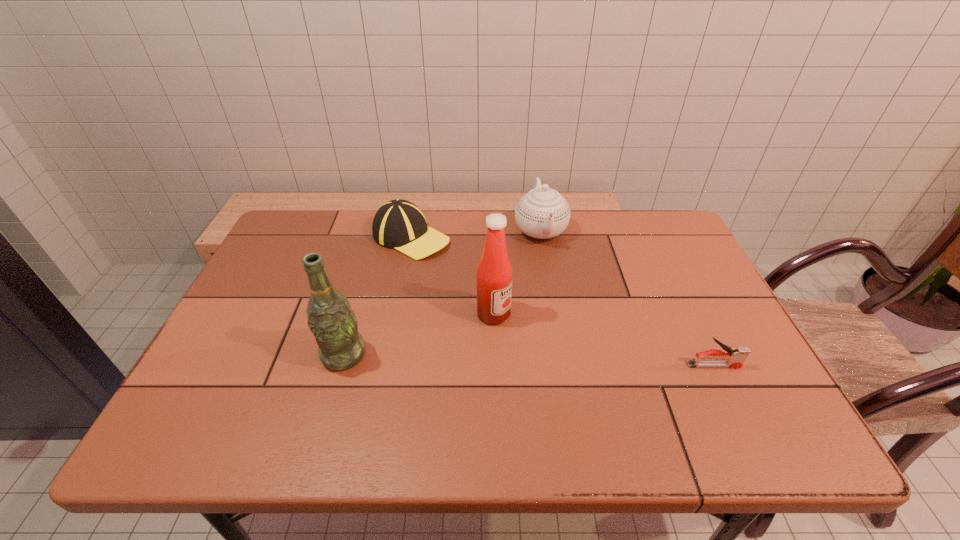
Locate an element on the screen. The height and width of the screenshot is (540, 960). vacant area between the baseball cap and the beer bottle is located at coordinates click(377, 296).

Image resolution: width=960 pixels, height=540 pixels. I want to click on free space between the third farthest object and the rightmost object, so click(604, 340).

This screenshot has height=540, width=960. In order to click on free space between the beer bottle and the third farthest object in this screenshot , I will do click(x=419, y=334).

The image size is (960, 540). What are the coordinates of `vacant space that's between the beer bottle and the condiment` in the screenshot? It's located at (419, 334).

The height and width of the screenshot is (540, 960). What are the coordinates of `vacant area that lies between the third farthest object and the rightmost object` in the screenshot? It's located at (604, 340).

Where is `vacant space in between the beer bottle and the baseball cap`? vacant space in between the beer bottle and the baseball cap is located at coordinates (377, 296).

Locate which object is the third closest to the beer bottle. Please provide its 2D coordinates. Your answer should be formatted as a tuple, i.e. [(x, y)], where the tuple contains the x and y coordinates of a point satisfying the conditions above.

[(542, 213)]

Find the location of a particular element. The height and width of the screenshot is (540, 960). the fourth closest object to the beer bottle is located at coordinates (735, 358).

You are a GUI agent. You are given a task and a screenshot of the screen. Output one action in this format:
    pyautogui.click(x=<x>, y=<y>)
    Task: Click on the free region that satisfies the following two spatial constraints: 1. on the surface of the beer bottle; 2. on the handle side of the stapler
    The image size is (960, 540).
    Given the screenshot: What is the action you would take?
    pyautogui.click(x=341, y=366)

Locate an element on the screen. This screenshot has height=540, width=960. vacant region that satisfies the following two spatial constraints: 1. on the back side of the baseball cap; 2. on the left side of the fourth object from left to right is located at coordinates (413, 230).